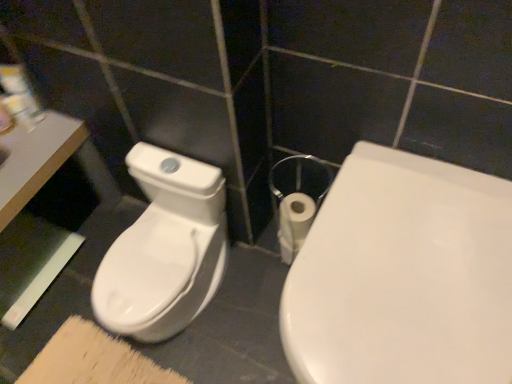
The height and width of the screenshot is (384, 512). I want to click on blank space situated above white glossy toilet at center (from a real-world perspective), so click(x=412, y=262).